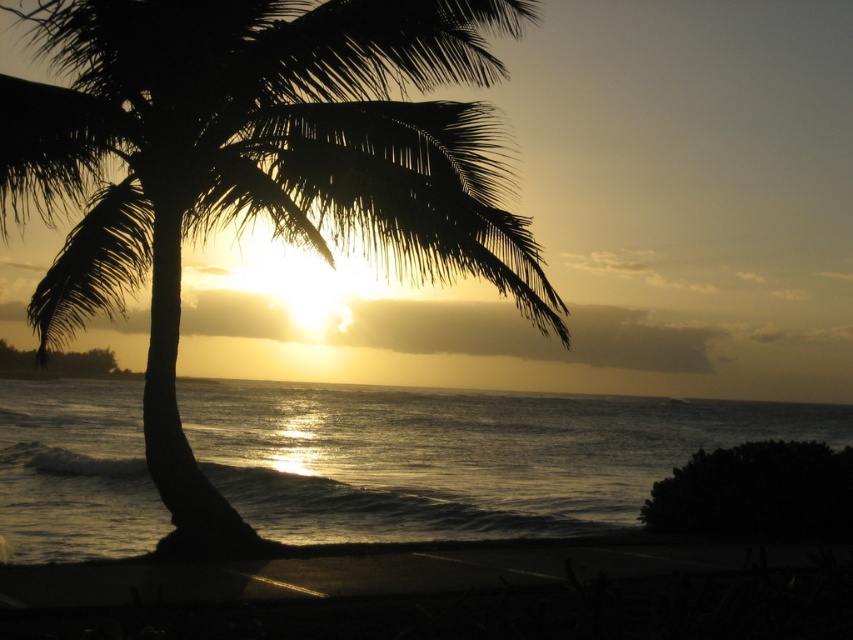
You are standing on the beach and want to take a photo of the palm tree silhouette. You notice a point at coordinates point (77, 51) that is 41.12 feet away from you. If you move 10 feet closer to this point, how far will you be from the palm tree silhouette?

The point (77, 51) is 41.12 feet from the camera. Moving 10 feet closer reduces the distance to 31.12 feet. Therefore, you will be 31.12 feet away from the palm tree silhouette.

You are standing on the beach and want to take a photo of both the palm tree and the sunset reflection. The palm tree is at point [117,273] and the sunset reflection is at point [509,502]. Which point should you focus on first to ensure both are in the frame?

You should focus on point [117,273] first because it is closer to the camera than point [509,502], ensuring both points are within the frame.

You are a photographer standing at the silhouette leafy palm at center, aiming to capture a wide shot of the glistening silver water at center. Given that your camera has a maximum focus range of 30 meters, will you be able to capture the water clearly without moving closer?

The distance between the silhouette leafy palm at center and the glistening silver water at center is 29.18 meters, which is within the camera maximum focus range of 30 meters. Therefore, you can capture the glistening silver water at center clearly without moving closer.